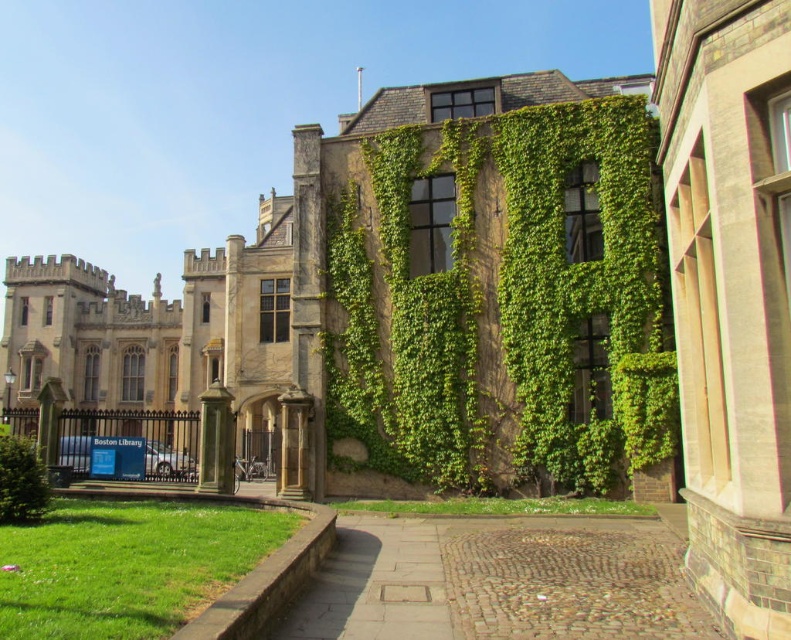
You are standing at the entrance of the historic building and want to walk to the cobblestone path at lower center. According to the image, in which direction should you head relative to your current position?

The cobblestone path at lower center is located at point (x=500, y=582), which is to the lower center direction from your current position at the entrance.

Based on the photo, you are standing at the entrance of the historic building and want to take a photo of the green textured ivy at center. Where should you position yourself to capture the ivy in the frame?

To capture the green textured ivy at center in the frame, position yourself at the entrance and aim your camera towards the center of the building where the ivy is located at coordinates point (504, 304).